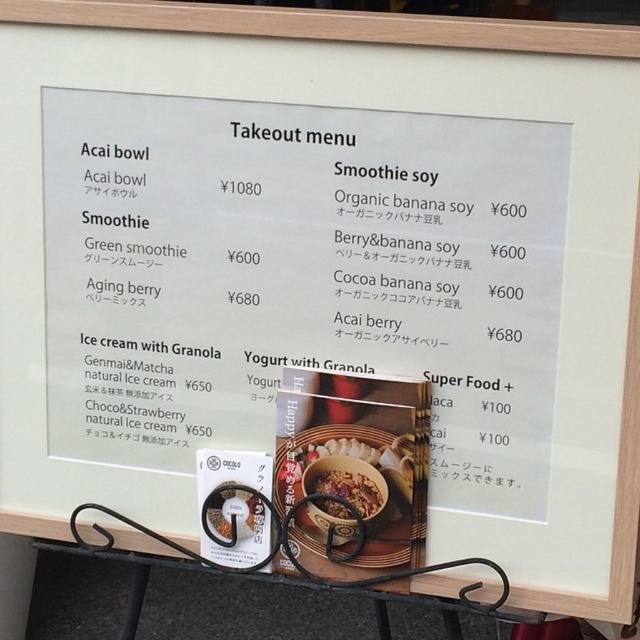
Which of these two, smooth granola bowl at center or matte brown bowl at center, stands shorter?

matte brown bowl at center

Does smooth granola bowl at center have a larger size compared to matte brown bowl at center?

Yes, smooth granola bowl at center is bigger than matte brown bowl at center.

You are a GUI agent. You are given a task and a screenshot of the screen. Output one action in this format:
    pyautogui.click(x=<x>, y=<y>)
    Task: Click on the smooth granola bowl at center
    
    Given the screenshot: What is the action you would take?
    pyautogui.click(x=346, y=493)

I want to click on smooth granola bowl at center, so click(x=346, y=493).